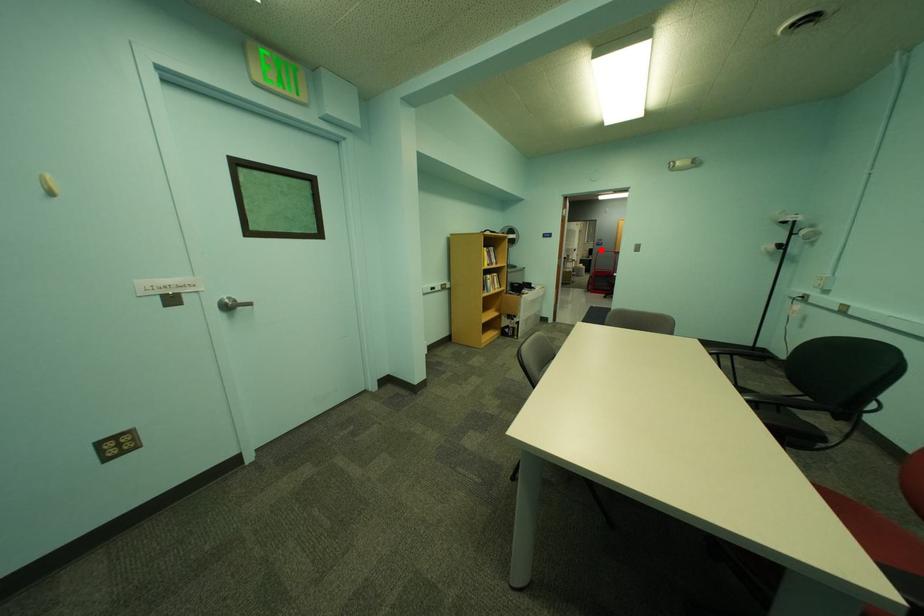
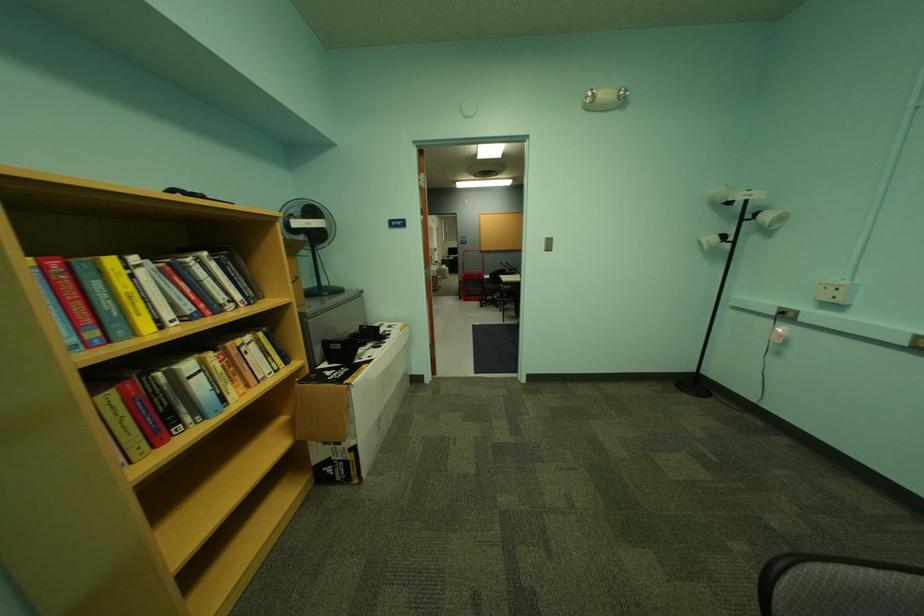
In the second image, find the point that corresponds to the highlighted location in the first image.

(466, 249)